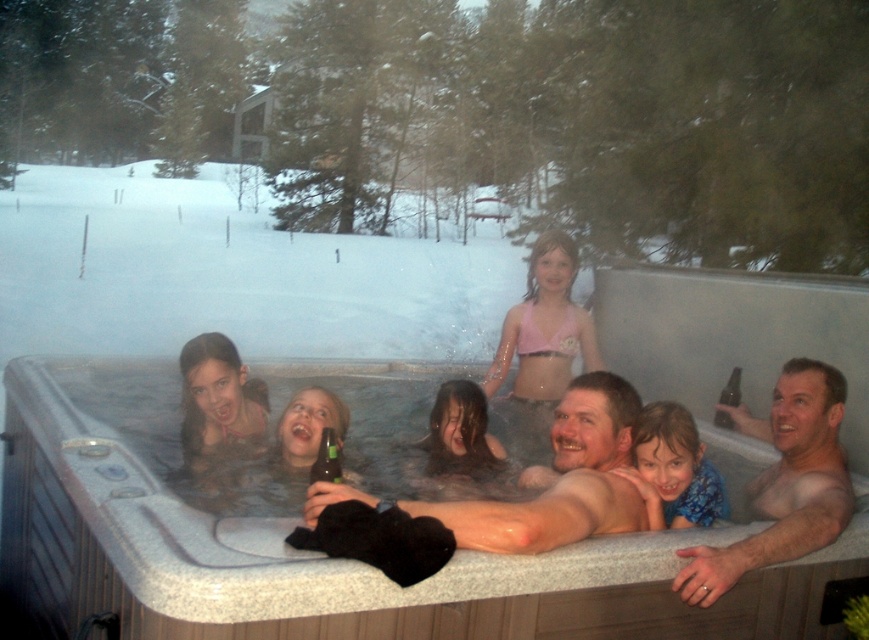
You are a guest at this winter retreat and want to place a small decorative snow globe on the blue fabric at center without it touching the smooth gray hot tub at center. Is this possible?

The smooth gray hot tub at center is taller than blue fabric at center, so placing the snow globe on the blue fabric at center without touching the hot tub may be possible as long as the snow globe is placed away from the hot tub.

You are standing in the snowy area and want to move from the smooth gray hot tub at center to the smooth skin adult at center. Which direction should you move to reach them?

You should move to the right to reach the smooth skin adult at center because the smooth gray hot tub at center is to the left of them.